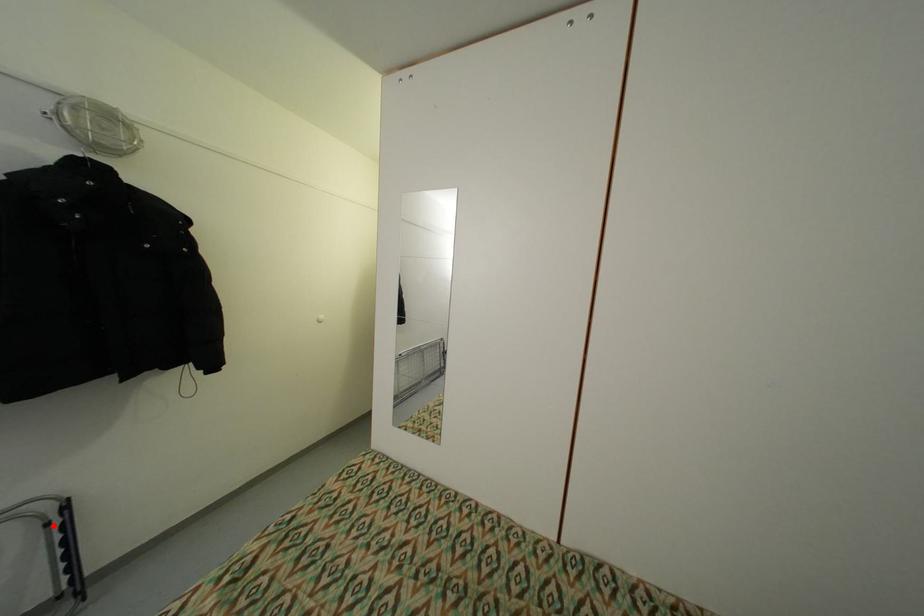
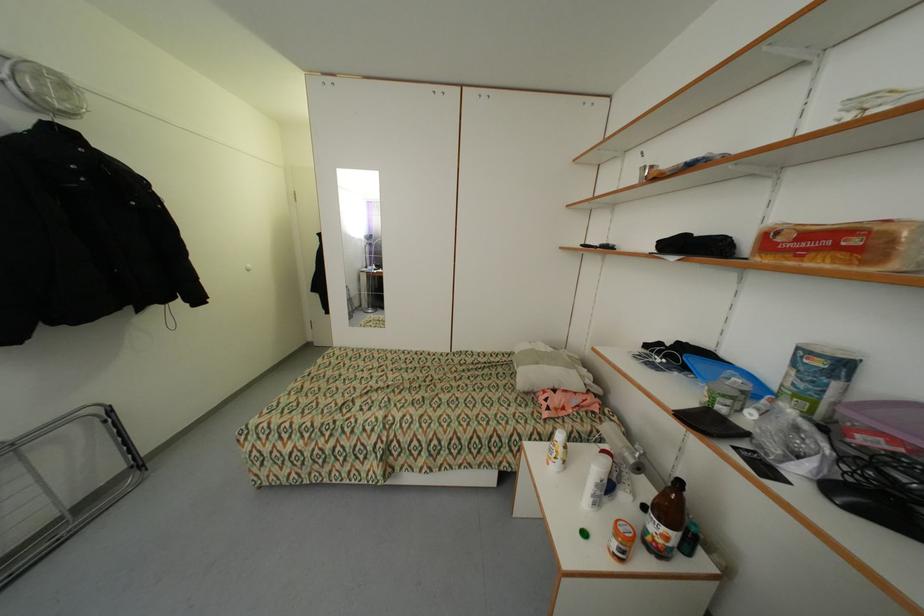
Where in the second image is the point corresponding to the highlighted location from the first image?

(112, 422)